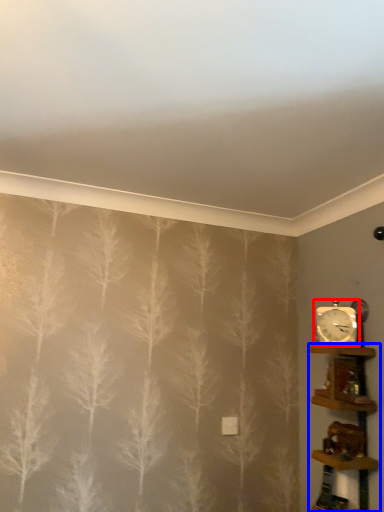
Question: Which object appears closest to the camera in this image, clock (highlighted by a red box) or shelf (highlighted by a blue box)?

Choices:
 (A) clock
 (B) shelf

Answer: (B)